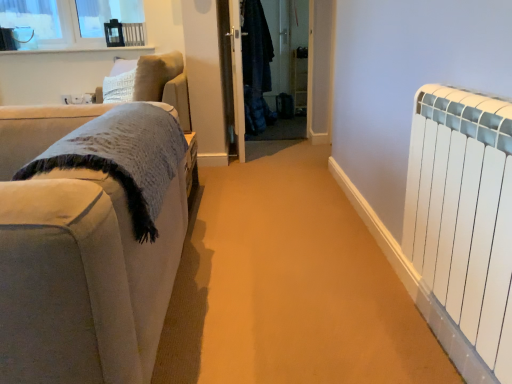
Question: Based on their sizes in the image, would you say white glossy window sill at upper left is bigger or smaller than denim jacket at center, positioned as the second screen door in left-to-right order?

Choices:
 (A) big
 (B) small

Answer: (B)

Question: Considering the positions of white glossy window sill at upper left and denim jacket at center, positioned as the second screen door in left-to-right order, in the image, is white glossy window sill at upper left wider or thinner than denim jacket at center, positioned as the second screen door in left-to-right order,?

Choices:
 (A) wide
 (B) thin

Answer: (B)

Question: Estimate the real-world distances between objects in this image. Which object is farther from the suede-like beige couch at left?

Choices:
 (A) white glass window at upper left
 (B) denim jacket at center, positioned as the second screen door in left-to-right order
 (C) white matte radiator at right
 (D) white glossy window sill at upper left
 (E) transparent glass door at center, the first screen door positioned from the left

Answer: (D)

Question: Which of these objects is positioned closest to the suede-like beige couch at left?

Choices:
 (A) white glass window at upper left
 (B) white glossy window sill at upper left
 (C) transparent glass door at center, the 2th screen door from the right
 (D) white matte radiator at right
 (E) denim jacket at center, positioned as the second screen door in left-to-right order

Answer: (D)